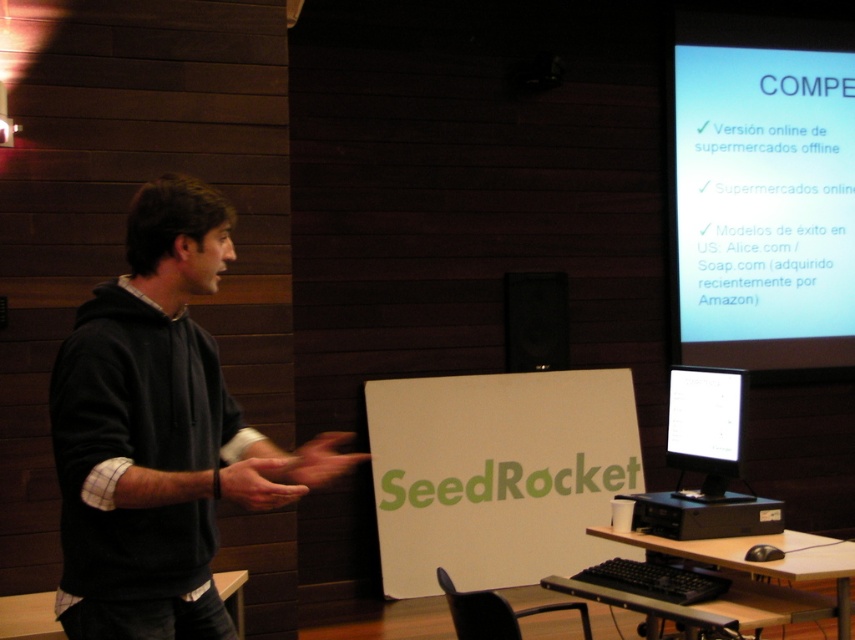
Question: Does dark gray hoodie at left appear on the right side of matte black monitor at center?

Choices:
 (A) no
 (B) yes

Answer: (A)

Question: Which point is farther from the camera taking this photo?

Choices:
 (A) (156, 214)
 (B) (659, 513)
 (C) (832, 221)
 (D) (688, 388)

Answer: (C)

Question: Among these points, which one is farthest from the camera?

Choices:
 (A) (635, 516)
 (B) (728, 445)
 (C) (741, 76)

Answer: (C)

Question: Which object appears closest to the camera in this image?

Choices:
 (A) black plastic monitor at lower right
 (B) white glossy projector screen at upper right
 (C) dark gray hoodie at left

Answer: (C)

Question: Is black plastic monitor at lower right wider than matte black monitor at center?

Choices:
 (A) no
 (B) yes

Answer: (B)

Question: Is white glossy projector screen at upper right further to the viewer compared to matte black monitor at center?

Choices:
 (A) no
 (B) yes

Answer: (B)